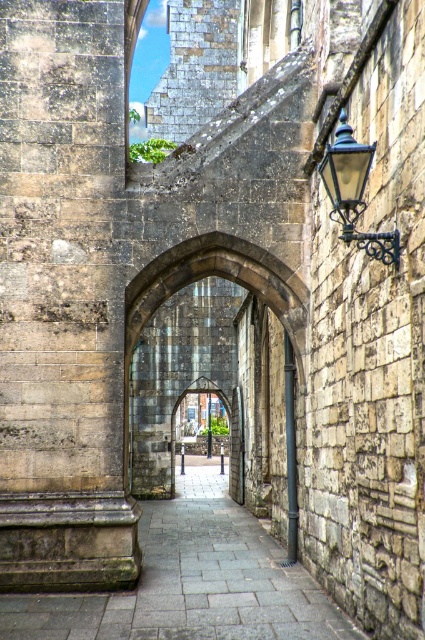
Question: Does gray stone pillar at left appear on the left side of stone archway at center?

Choices:
 (A) yes
 (B) no

Answer: (A)

Question: Among these points, which one is farthest from the camera?

Choices:
 (A) (67, 260)
 (B) (377, 257)

Answer: (A)

Question: Does gray stone pillar at left have a lesser width compared to gray stone path at center?

Choices:
 (A) yes
 (B) no

Answer: (A)

Question: Does gray stone path at center have a greater width compared to stone archway at center?

Choices:
 (A) yes
 (B) no

Answer: (A)

Question: Which of the following is the farthest from the observer?

Choices:
 (A) (210, 266)
 (B) (379, 236)
 (C) (198, 465)

Answer: (C)

Question: Which object appears closest to the camera in this image?

Choices:
 (A) gray stone pillar at left
 (B) gray stone path at center
 (C) stone archway at center
 (D) black wrought iron lamp at upper right

Answer: (D)